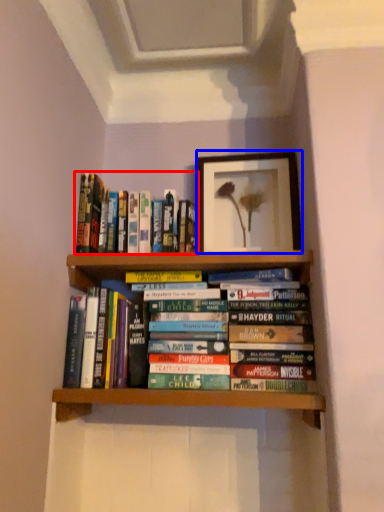
Question: Which object is further to the camera taking this photo, book (highlighted by a red box) or picture frame (highlighted by a blue box)?

Choices:
 (A) book
 (B) picture frame

Answer: (B)